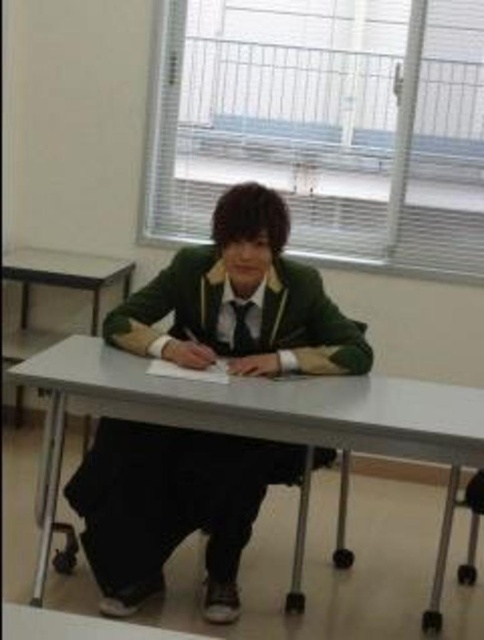
You are a tailor observing a person wearing a green fabric uniform at center and a matte black tie at center. Which clothing item is positioned lower on the body?

The green fabric uniform at center is below matte black tie at center, so the green fabric uniform at center is positioned lower on the body.

You are a student who needs to place a textbook on the white plastic table at center without it touching the green fabric uniform at center. Is the table tall enough to allow this?

The green fabric uniform at center has a lesser height compared to white plastic table at center, so yes, the table is tall enough to place the textbook without it touching the uniform.